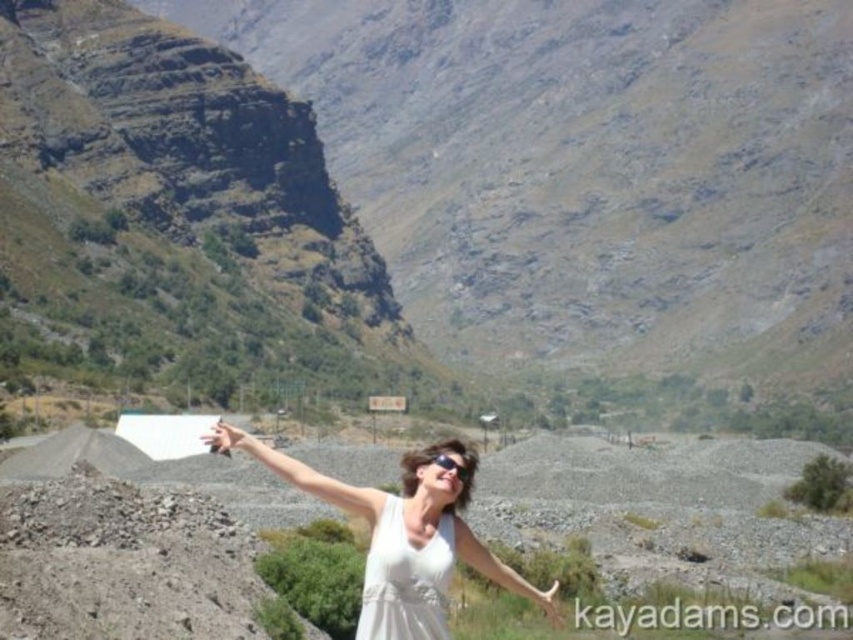
Question: Based on their relative distances, which object is nearer to the white matte dress at center?

Choices:
 (A) white matte hand at center
 (B) matte white hand at center
 (C) matte black sunglasses at center

Answer: (C)

Question: In this image, where is white cotton dress at center located relative to white matte dress at center?

Choices:
 (A) right
 (B) left

Answer: (B)

Question: Which point is farther to the camera?

Choices:
 (A) (556, 611)
 (B) (415, 573)
 (C) (238, 444)
 (D) (187, 332)

Answer: (D)

Question: Does brown rocky mountain at upper center appear under matte white hand at center?

Choices:
 (A) yes
 (B) no

Answer: (B)

Question: Which is farther from the white fabric arm at center?

Choices:
 (A) matte black sunglasses at center
 (B) white matte hand at center
 (C) white matte dress at center
 (D) brown rocky mountain at upper center

Answer: (D)

Question: Does white cotton dress at center appear on the right side of matte black sunglasses at center?

Choices:
 (A) yes
 (B) no

Answer: (B)